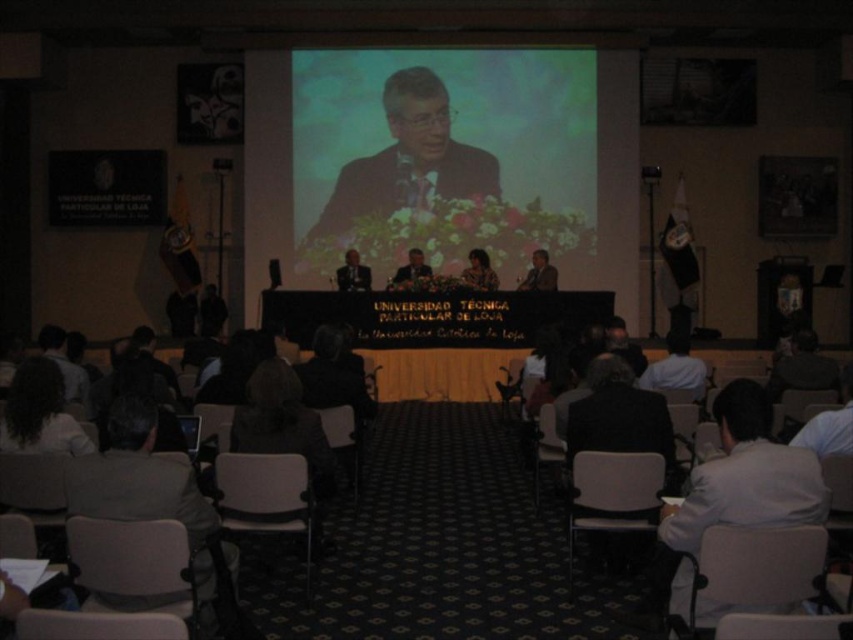
Is gray fabric chair at lower left further to the viewer compared to gray fabric chair at lower right?

Yes, it is.

In the scene shown: Who is lower down, gray fabric chair at lower left or gray fabric chair at lower right?

gray fabric chair at lower left is lower down.

Who is more forward, (x=120, y=538) or (x=813, y=540)?

Point (x=813, y=540) is in front.

Locate an element on the screen. Image resolution: width=853 pixels, height=640 pixels. gray fabric chair at lower left is located at coordinates (132, 563).

The width and height of the screenshot is (853, 640). I want to click on white shirt at lower right, so click(737, 486).

Is point (741, 438) farther from camera compared to point (259, 506)?

That is False.

Where is `white shirt at lower right`? This screenshot has width=853, height=640. white shirt at lower right is located at coordinates (737, 486).

Is light gray plastic chair at lower center above white shirt at center?

Actually, light gray plastic chair at lower center is below white shirt at center.

Who is more distant from viewer, (x=248, y=458) or (x=672, y=344)?

Positioned behind is point (x=672, y=344).

Identify the location of light gray plastic chair at lower center. Image resolution: width=853 pixels, height=640 pixels. (265, 497).